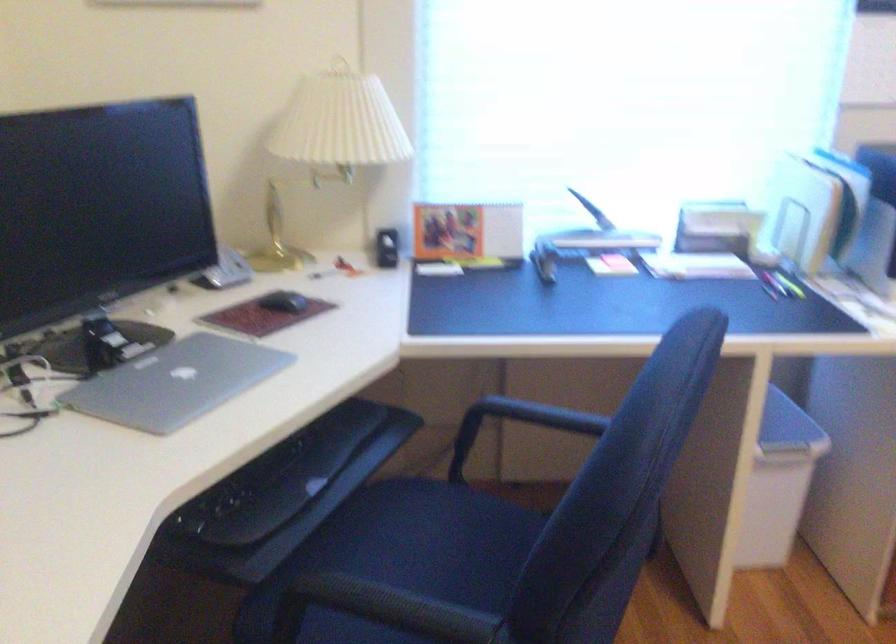
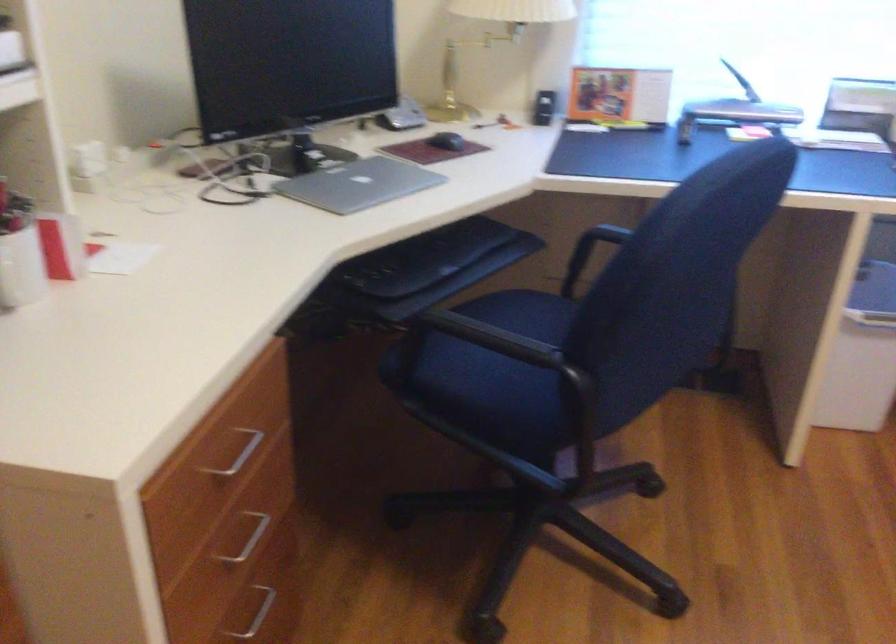
Find the pixel in the second image that matches the point at 282,306 in the first image.

(446, 140)